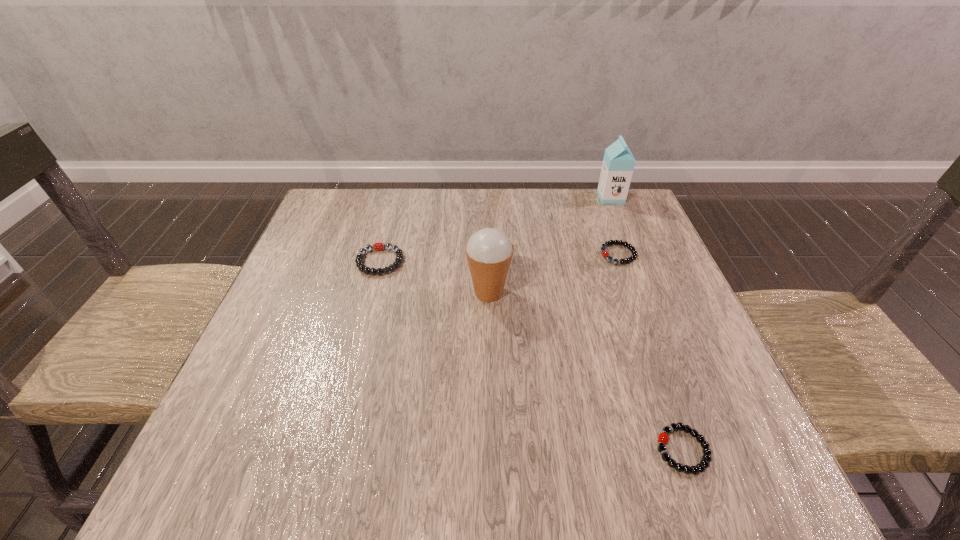
Identify the location of object that is at the far edge. (618, 164).

This screenshot has height=540, width=960. In order to click on object that is at the near edge in this screenshot , I will do `click(663, 438)`.

This screenshot has width=960, height=540. I want to click on object that is positioned at the left edge, so click(378, 246).

Find the location of a particular element. milk carton that is at the right edge is located at coordinates (618, 164).

Locate an element on the screen. object at the far right corner is located at coordinates (618, 164).

Identify the location of object located in the near right corner section of the desktop. (663, 438).

The height and width of the screenshot is (540, 960). Find the location of `vacant space at the far edge of the desktop`. vacant space at the far edge of the desktop is located at coordinates [486, 209].

At what (x,y) coordinates should I click in order to perform the action: click on vacant position at the near edge of the desktop. Please return your answer as a coordinate pair (x, y). Looking at the image, I should click on (614, 475).

At what (x,y) coordinates should I click in order to perform the action: click on vacant space at the left edge of the desktop. Please return your answer as a coordinate pair (x, y). The width and height of the screenshot is (960, 540). Looking at the image, I should click on pyautogui.click(x=300, y=329).

You are a GUI agent. You are given a task and a screenshot of the screen. Output one action in this format:
    pyautogui.click(x=<x>, y=<y>)
    Task: Click on the free space at the right edge of the desktop
    
    Given the screenshot: What is the action you would take?
    pyautogui.click(x=675, y=278)